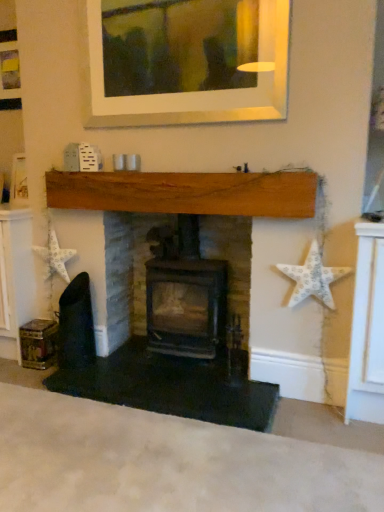
I want to click on free space above white textured star at right, the first starfish from the right (from a real-world perspective), so (325, 217).